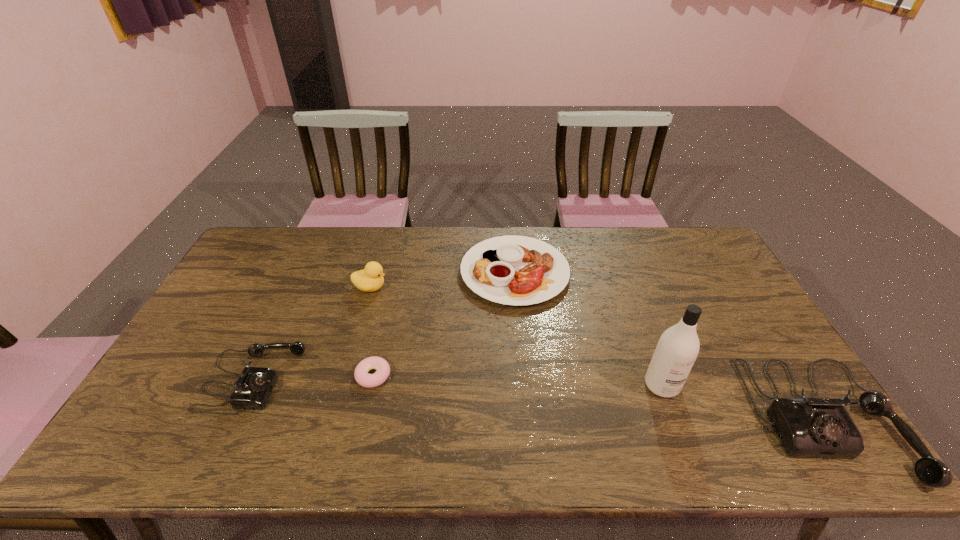
Image resolution: width=960 pixels, height=540 pixels. What are the coordinates of `object that is at the near left corner` in the screenshot? It's located at (252, 390).

Where is `object that is at the near right corner`? The height and width of the screenshot is (540, 960). object that is at the near right corner is located at coordinates (808, 427).

At what (x,y) coordinates should I click in order to perform the action: click on free location at the far edge of the desktop. Please return your answer as a coordinate pair (x, y). Image resolution: width=960 pixels, height=540 pixels. Looking at the image, I should click on pyautogui.click(x=527, y=235).

In the image, there is a desktop. Identify the location of vacant space at the near edge. (369, 399).

In the image, there is a desktop. At what (x,y) coordinates should I click in order to perform the action: click on free space at the right edge. Please return your answer as a coordinate pair (x, y). Looking at the image, I should click on (760, 370).

Where is `free space between the shorter telephone and the duck`? free space between the shorter telephone and the duck is located at coordinates (311, 333).

Where is `unoccupied area between the fifth tallest object and the fifth object from left to right`? The image size is (960, 540). unoccupied area between the fifth tallest object and the fifth object from left to right is located at coordinates (588, 328).

At what (x,y) coordinates should I click in order to perform the action: click on empty space that is in between the platter and the left telephone. Please return your answer as a coordinate pair (x, y). The image size is (960, 540). Looking at the image, I should click on (384, 326).

Find the location of `free space that is in between the doughnut and the duck`. free space that is in between the doughnut and the duck is located at coordinates (372, 332).

Find the location of a particular element. free space between the taller telephone and the second object from right to left is located at coordinates 743,402.